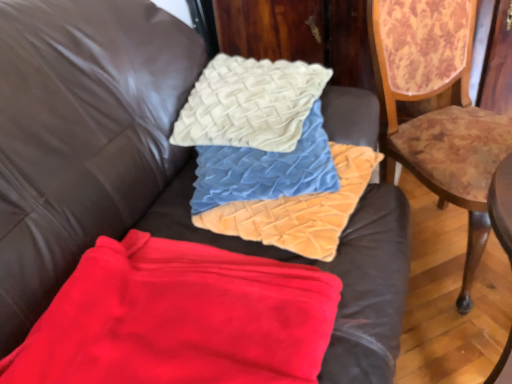
Question: Should I look upward or downward to see wooden floral-patterned chair at right?

Choices:
 (A) down
 (B) up

Answer: (B)

Question: From a real-world perspective, is velvet textured pillow at center over velvet textured pillows at center, which is the 1th material in top-to-bottom order?

Choices:
 (A) no
 (B) yes

Answer: (B)

Question: Is velvet textured pillow at center placed right next to velvet textured pillows at center, the second material positioned from the bottom?

Choices:
 (A) yes
 (B) no

Answer: (A)

Question: From the image's perspective, does velvet textured pillow at center appear higher than velvet textured pillows at center, the second material positioned from the bottom?

Choices:
 (A) no
 (B) yes

Answer: (B)

Question: Does velvet textured pillow at center have a greater height compared to velvet textured pillows at center, which is the 1th material in top-to-bottom order?

Choices:
 (A) no
 (B) yes

Answer: (B)

Question: Is velvet textured pillow at center closer to the viewer compared to velvet textured pillows at center, the second material positioned from the bottom?

Choices:
 (A) no
 (B) yes

Answer: (A)

Question: Is velvet textured pillow at center oriented away from velvet textured pillows at center, the second material positioned from the bottom?

Choices:
 (A) no
 (B) yes

Answer: (A)

Question: Is red fleece blanket at lower left, the second material when ordered from top to bottom, inside velvet textured pillows at center, which is the 1th material in top-to-bottom order?

Choices:
 (A) no
 (B) yes

Answer: (A)

Question: Are velvet textured pillows at center, the second material positioned from the bottom, and red fleece blanket at lower left, which appears as the 1th material when ordered from the bottom, far apart?

Choices:
 (A) yes
 (B) no

Answer: (B)

Question: Does velvet textured pillows at center, the second material positioned from the bottom, have a greater width compared to red fleece blanket at lower left, which appears as the 1th material when ordered from the bottom?

Choices:
 (A) no
 (B) yes

Answer: (A)

Question: Does velvet textured pillows at center, which is the 1th material in top-to-bottom order, touch red fleece blanket at lower left, which appears as the 1th material when ordered from the bottom?

Choices:
 (A) yes
 (B) no

Answer: (B)

Question: Is velvet textured pillows at center, the second material positioned from the bottom, oriented away from red fleece blanket at lower left, which appears as the 1th material when ordered from the bottom?

Choices:
 (A) yes
 (B) no

Answer: (B)

Question: From the image's perspective, is velvet textured pillows at center, the second material positioned from the bottom, beneath red fleece blanket at lower left, which appears as the 1th material when ordered from the bottom?

Choices:
 (A) yes
 (B) no

Answer: (B)

Question: Is velvet textured pillow at center not near wooden floral-patterned chair at right?

Choices:
 (A) yes
 (B) no

Answer: (B)